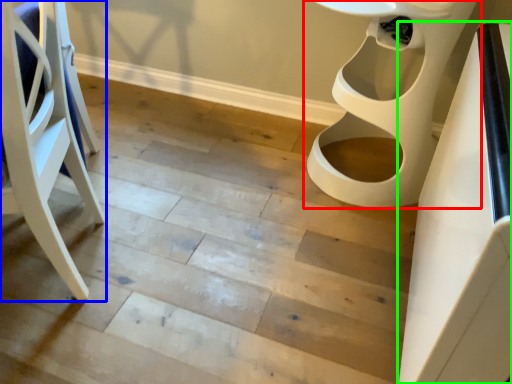
Question: Which is farther away from toilet (highlighted by a red box)? furniture (highlighted by a blue box) or table (highlighted by a green box)?

Choices:
 (A) furniture
 (B) table

Answer: (A)